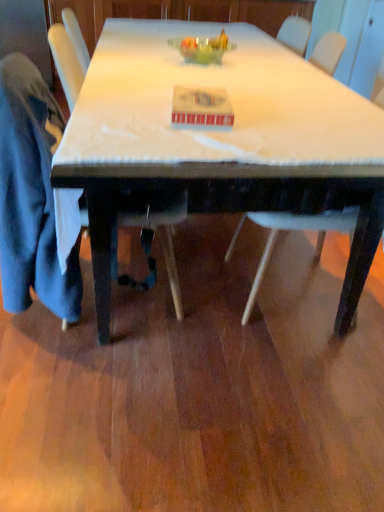
At what (x,y) coordinates should I click in order to perform the action: click on vacant space to the right of velvet blue jacket at left, arranged as the first chair when viewed from the left. Please return your answer as a coordinate pair (x, y). Looking at the image, I should click on (214, 324).